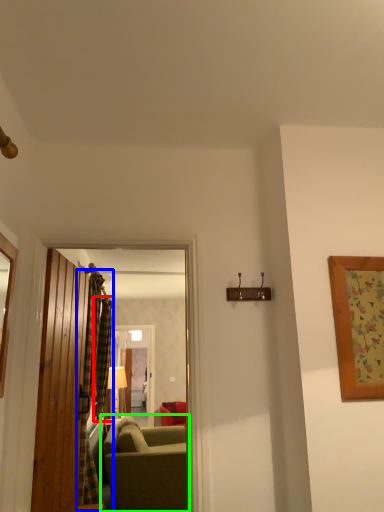
Question: Considering the real-world distances, which object is closest to curtain (highlighted by a red box)? curtain (highlighted by a blue box) or studio couch (highlighted by a green box).

Choices:
 (A) curtain
 (B) studio couch

Answer: (A)